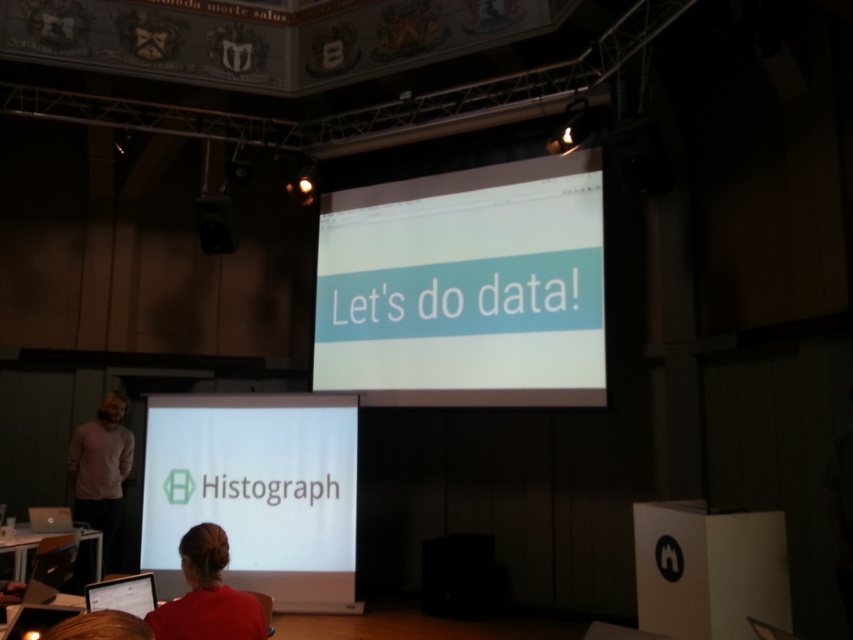
Can you confirm if blonde hair at lower left is positioned below black plastic speaker at upper center?

Yes.

Which is behind, point (45, 636) or point (206, 216)?

The point (206, 216) is more distant.

This screenshot has height=640, width=853. I want to click on blonde hair at lower left, so click(x=100, y=627).

Is white glossy projector screen at center wider than white matte projection screen at center?

Indeed, white glossy projector screen at center has a greater width compared to white matte projection screen at center.

Is point (575, 332) positioned before point (236, 429)?

Yes, it is.

Does point (413, 253) come closer to viewer compared to point (264, 540)?

No, it is not.

Find the location of `white glossy projector screen at center`. white glossy projector screen at center is located at coordinates (465, 288).

Is white glossy projector screen at center in front of red fabric shirt at lower center?

No, it is not.

Measure the distance between white glossy projector screen at center and red fabric shirt at lower center.

white glossy projector screen at center is 12.66 feet away from red fabric shirt at lower center.

This screenshot has width=853, height=640. I want to click on white glossy projector screen at center, so click(x=465, y=288).

Where is `white glossy projector screen at center`? Image resolution: width=853 pixels, height=640 pixels. white glossy projector screen at center is located at coordinates (465, 288).